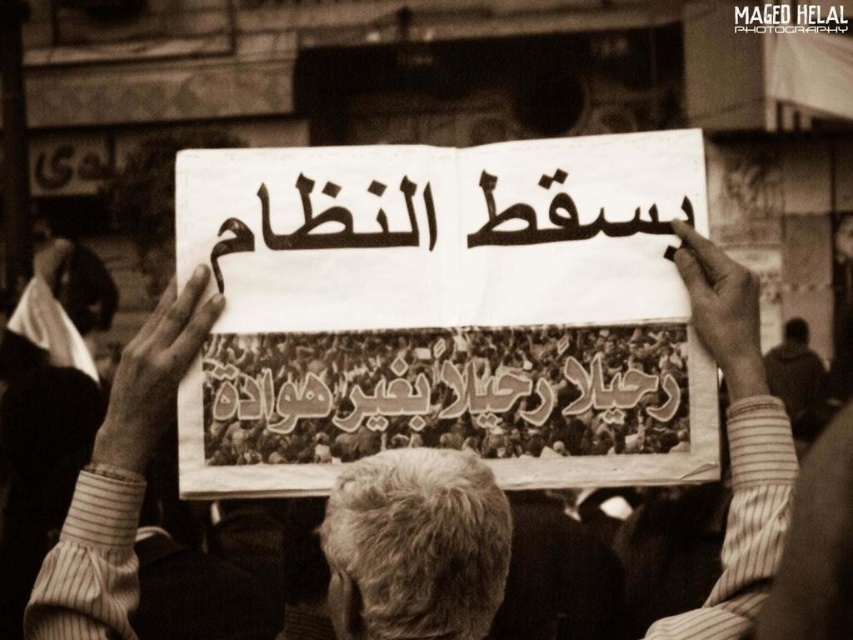
Does white paper at center have a smaller size compared to striped shirt at center?

No, white paper at center is not smaller than striped shirt at center.

Is white paper at center taller than striped shirt at center?

Yes, white paper at center is taller than striped shirt at center.

In order to click on white paper at center in this screenshot , I will do `click(445, 310)`.

Find the location of a particular element. This screenshot has width=853, height=640. white paper at center is located at coordinates (445, 310).